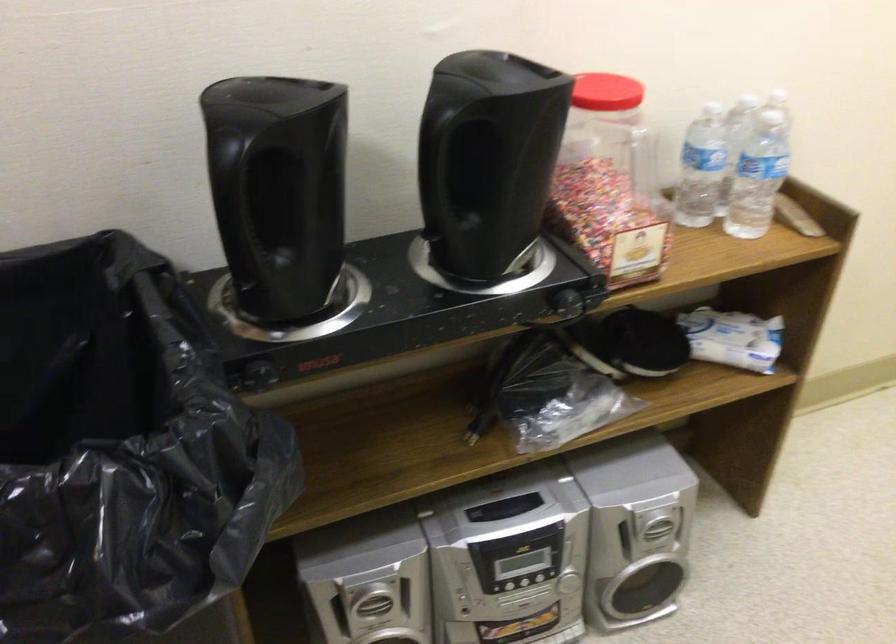
Identify the location of round speaker button. (658, 527).